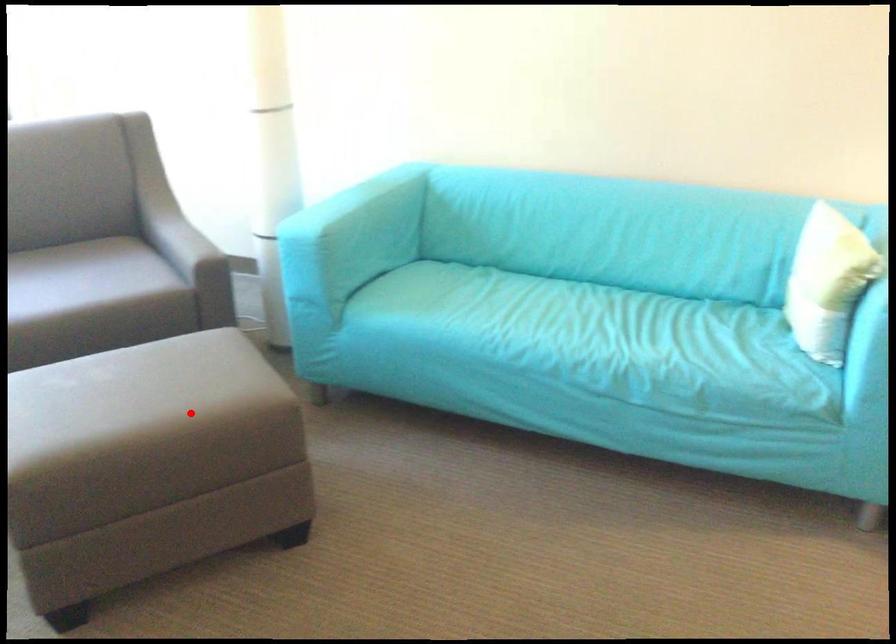
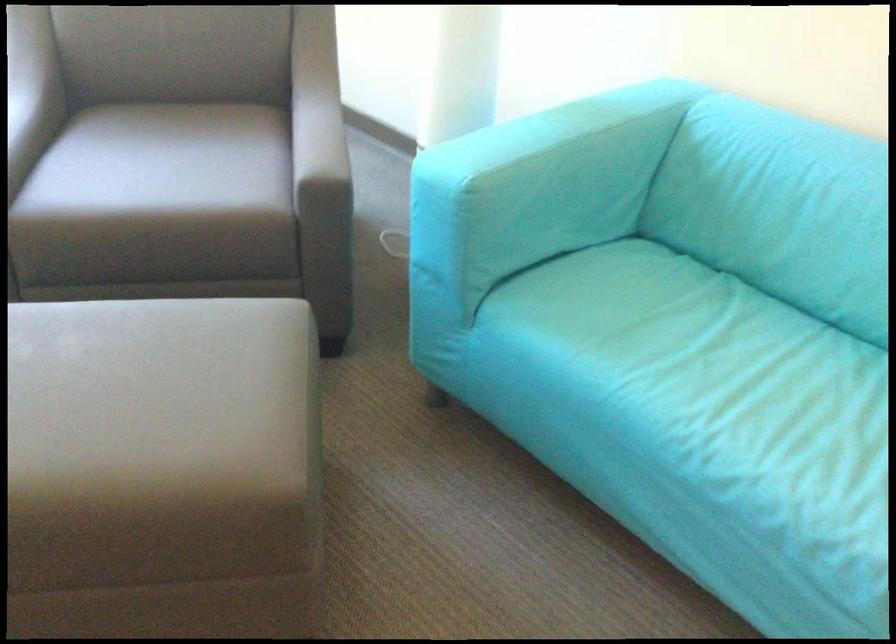
Question: I am providing you with two images of the same scene from different viewpoints. A red point is shown in image1. For the corresponding object point in image2, is it positioned nearer or farther from the camera?

Choices:
 (A) Nearer
 (B) Farther

Answer: (A)